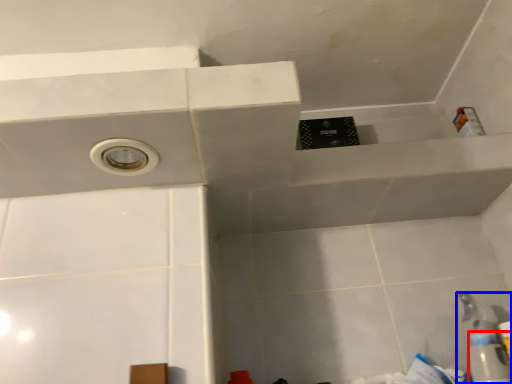
Question: Which object appears farthest to the camera in this image, bottle (highlighted by a red box) or plumbing fixture (highlighted by a blue box)?

Choices:
 (A) bottle
 (B) plumbing fixture

Answer: (B)